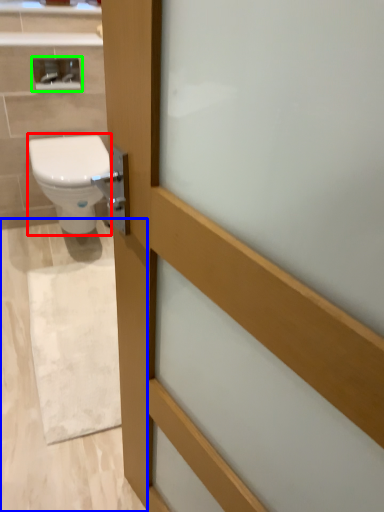
Question: Which object is positioned closest to bidet (highlighted by a red box)? Select from plain (highlighted by a blue box) and medicine cabinet (highlighted by a green box).

Choices:
 (A) plain
 (B) medicine cabinet

Answer: (B)